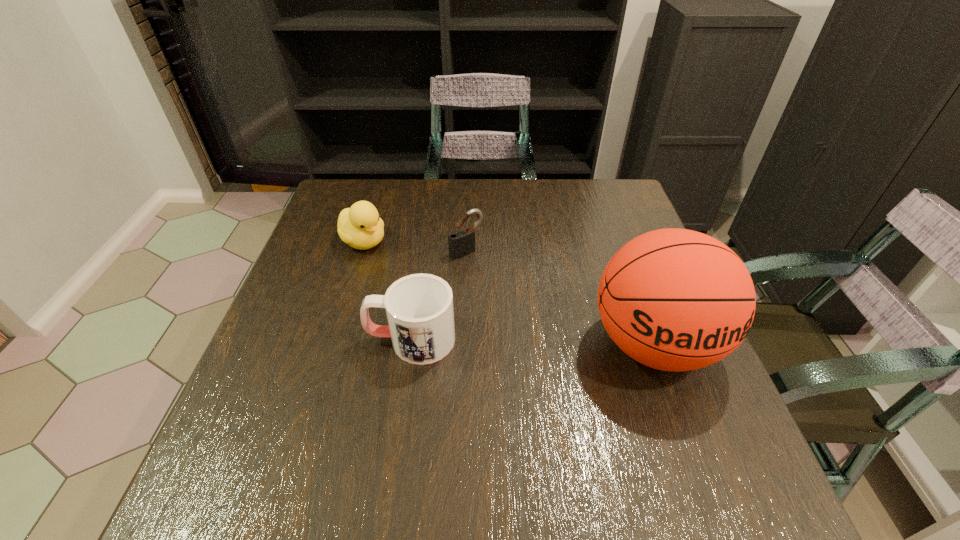
The image size is (960, 540). In order to click on mug in this screenshot , I will do `click(419, 307)`.

Identify the location of the tallest object. (673, 299).

The height and width of the screenshot is (540, 960). I want to click on basketball, so click(x=673, y=299).

This screenshot has height=540, width=960. Identify the location of the leftmost object. (359, 226).

Find the location of a particular element. padlock is located at coordinates (461, 242).

This screenshot has width=960, height=540. Find the location of `vacant region located 0.060m on the side of the mug with the handle`. vacant region located 0.060m on the side of the mug with the handle is located at coordinates (339, 340).

In order to click on vacant space positioned 0.190m on the side of the mug with the handle in this screenshot , I will do `click(277, 340)`.

This screenshot has width=960, height=540. I want to click on free point located 0.090m on the side of the mug with the handle, so click(324, 340).

I want to click on free space located 0.060m on the side with logo of the tallest object, so click(685, 431).

Where is `free space located on the front-facing side of the leftmost object`? Image resolution: width=960 pixels, height=540 pixels. free space located on the front-facing side of the leftmost object is located at coordinates (421, 282).